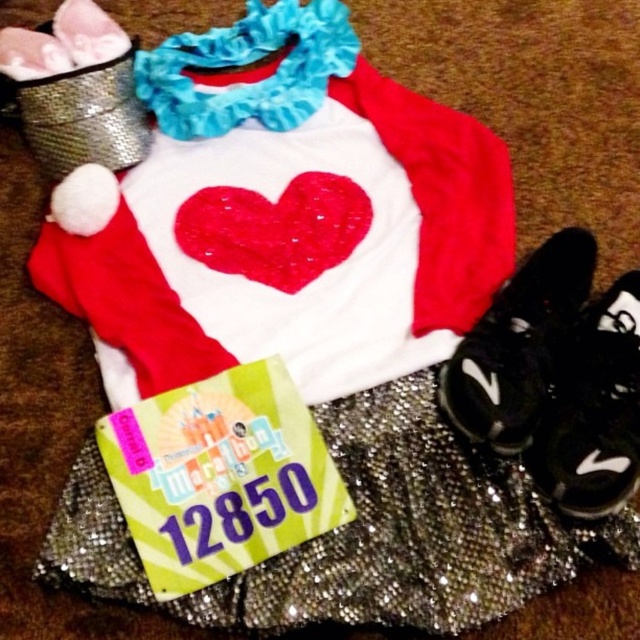
Looking at this image, you are standing in front of the items on the brown surface. There are two points marked here. The first point is at coordinates point [339,616] and the second is at point [278,208]. Which point is closer to you?

Point [339,616] is closer to the camera than point [278,208], so the first point is closer to you.

You are a dancer preparing for a performance and need to place your black mesh shoe at lower right next to the glittery sequined ballet skirt at center. Given that the minimum required space between your shoes and costume pieces is 8 inches for easy access, is the current distance sufficient?

The distance between the glittery sequined ballet skirt at center and the black mesh shoe at lower right is 7.61 inches, which is less than the required 8 inches. Therefore, the current spacing does not meet the minimum requirement for easy access.

Based on the photo, you are a photographer setting up a shot of the glittery sequined ballet skirt at center. If your camera can focus on objects within 30 inches, will you need to adjust your position?

The glittery sequined ballet skirt at center is 33.74 inches away from the camera, which is beyond the 30 inches focus range. You need to move closer to ensure proper focus.